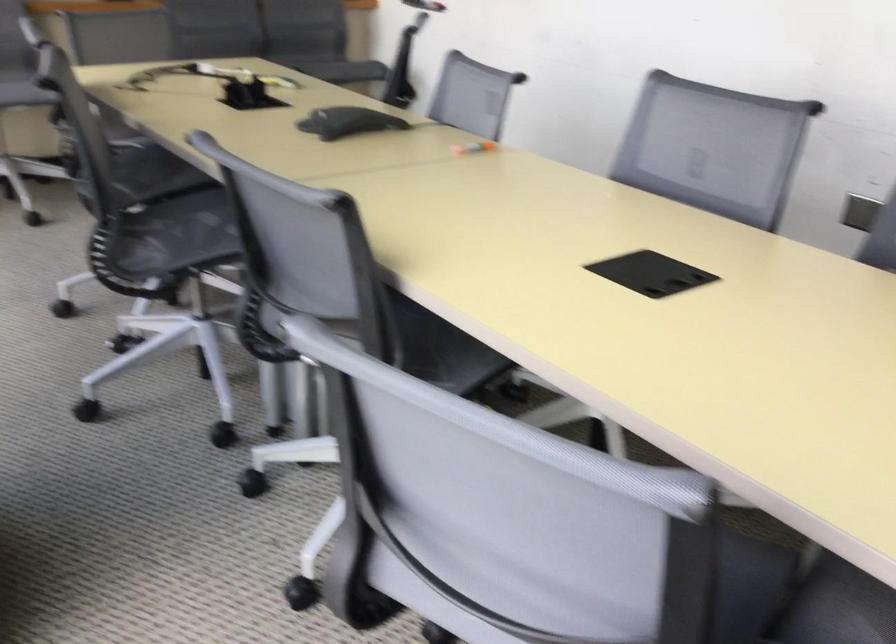
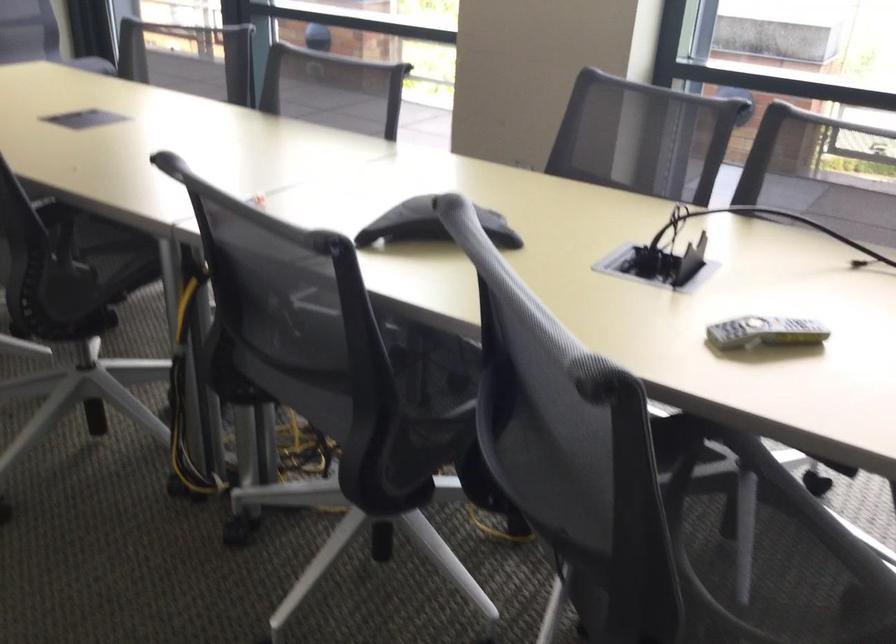
Question: I am providing you with two images of the same scene from different viewpoints. Which of the following objects are not visible in image2?

Choices:
 (A) chair sitting surface
 (B) black conference phone
 (C) grey remote control
 (D) black cap spice jar

Answer: (A)